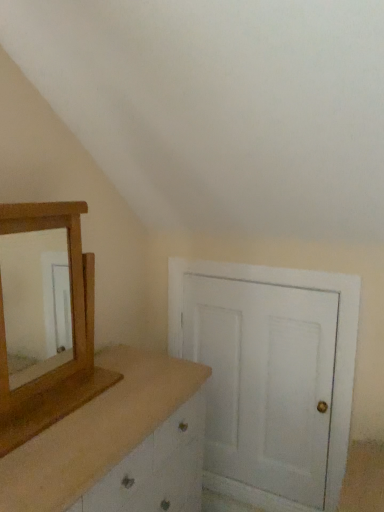
Locate an element on the screen. vacant space underneath wooden mirror at left (from a real-world perspective) is located at coordinates (59, 401).